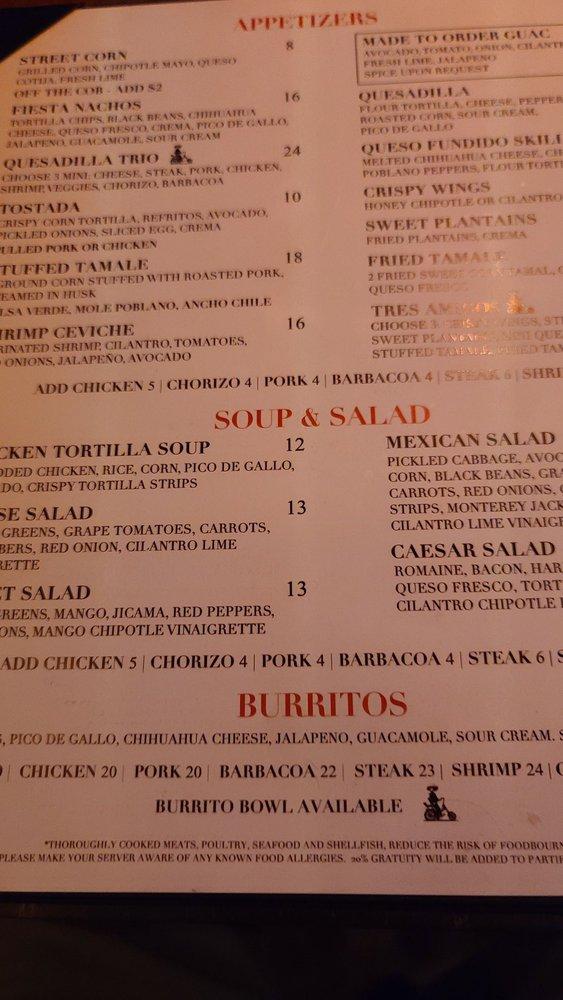
Identify the location of restaurant menu. (172, 24).